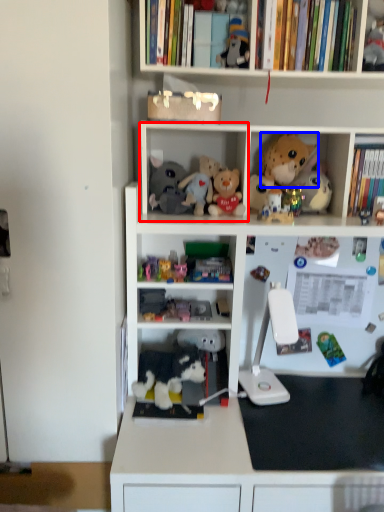
Question: Which point is further to the camera, cabinet (highlighted by a red box) or toy (highlighted by a blue box)?

Choices:
 (A) cabinet
 (B) toy

Answer: (B)